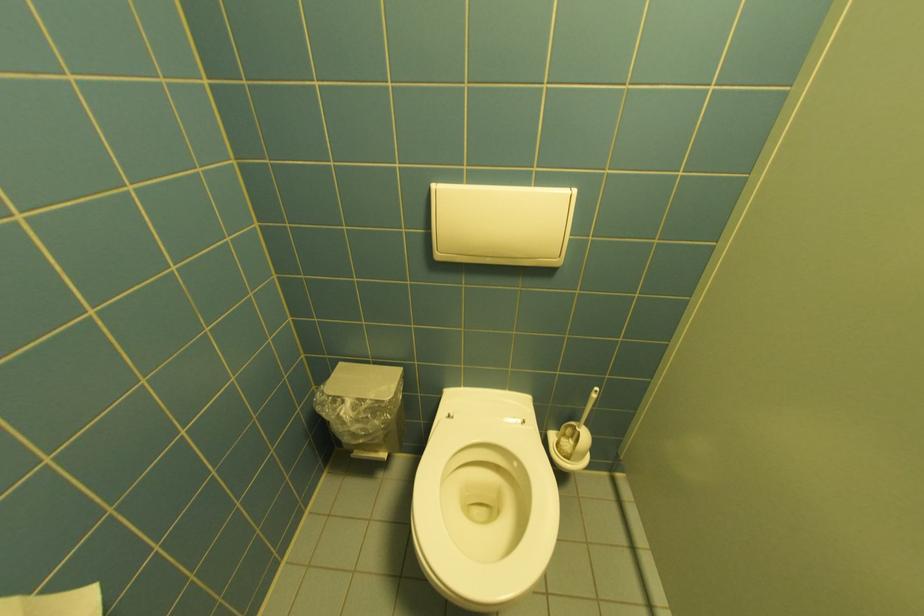
What do you see at coordinates (501, 220) in the screenshot? The width and height of the screenshot is (924, 616). I see `a white flush panel` at bounding box center [501, 220].